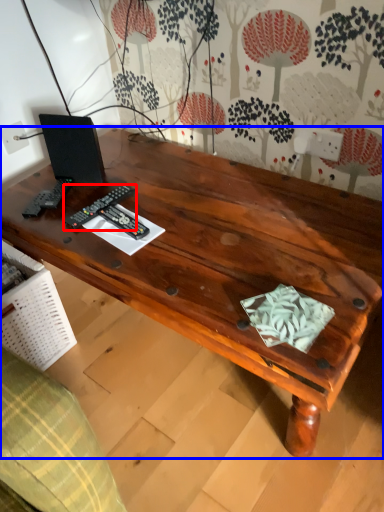
Question: Which object is further to the camera taking this photo, control (highlighted by a red box) or desk (highlighted by a blue box)?

Choices:
 (A) control
 (B) desk

Answer: (A)